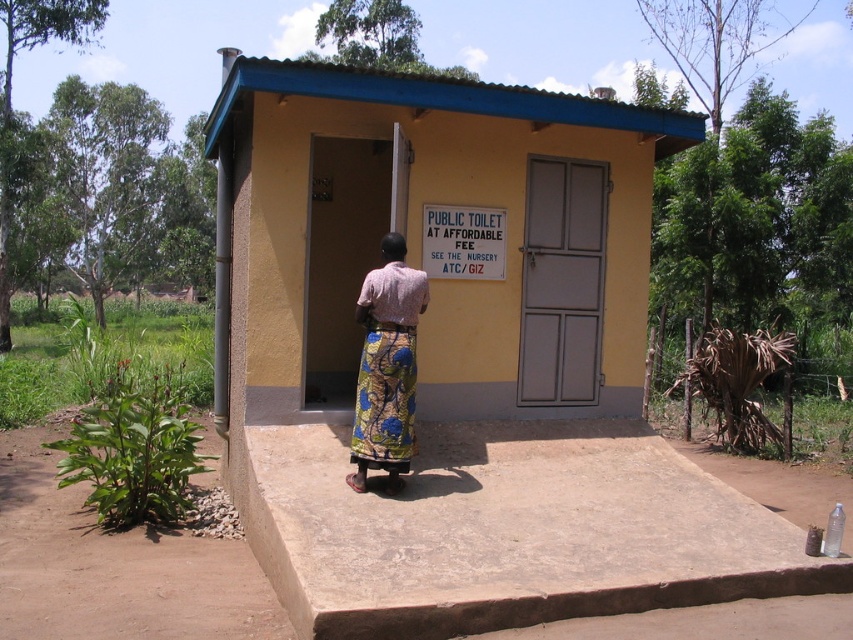
Find the location of a particular element. The height and width of the screenshot is (640, 853). printed fabric skirt at center is located at coordinates (386, 365).

Can you confirm if yellow matte public toilet at center is bigger than white plastic sign at upper center?

Correct, yellow matte public toilet at center is larger in size than white plastic sign at upper center.

Which of these two, yellow matte public toilet at center or white plastic sign at upper center, stands shorter?

Standing shorter between the two is yellow matte public toilet at center.

Measure the distance between point (257, 108) and camera.

Point (257, 108) and camera are 5.96 meters apart.

At what (x,y) coordinates should I click in order to perform the action: click on yellow matte public toilet at center. Please return your answer as a coordinate pair (x, y). This screenshot has height=640, width=853. Looking at the image, I should click on (421, 237).

Does yellow matte public toilet at center appear under printed fabric skirt at center?

Actually, yellow matte public toilet at center is above printed fabric skirt at center.

Can you confirm if yellow matte public toilet at center is shorter than printed fabric skirt at center?

Yes.

Between point (349, 161) and point (402, 246), which one is positioned behind?

Point (349, 161)

The height and width of the screenshot is (640, 853). In order to click on yellow matte public toilet at center in this screenshot , I will do `click(421, 237)`.